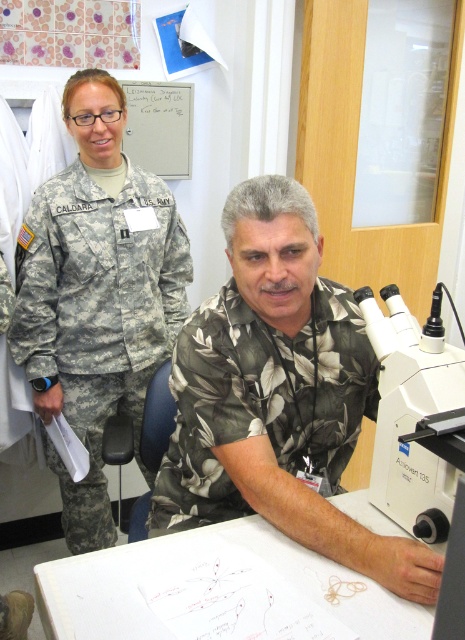
Question: Which is nearer to the camouflage fabric uniform at left?

Choices:
 (A) white plastic microscope at right
 (B) green leafy fabric shirt at center
 (C) floral shirt at center

Answer: (B)

Question: Can you confirm if green leafy fabric shirt at center is thinner than white plastic microscope at right?

Choices:
 (A) yes
 (B) no

Answer: (B)

Question: Which of the following is the closest to the observer?

Choices:
 (A) camouflage fabric uniform at left
 (B) white plastic microscope at right
 (C) floral shirt at center

Answer: (B)

Question: Does floral shirt at center come behind camouflage fabric uniform at left?

Choices:
 (A) no
 (B) yes

Answer: (A)

Question: Which point is closer to the camera?

Choices:
 (A) floral shirt at center
 (B) camouflage fabric uniform at left

Answer: (A)

Question: Observing the image, what is the correct spatial positioning of floral shirt at center in reference to camouflage fabric uniform at left?

Choices:
 (A) left
 (B) right

Answer: (B)